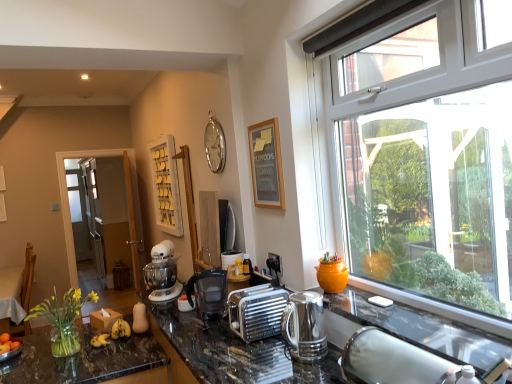
Question: Is white metallic mixer at center taller than white wooden shelf at upper center?

Choices:
 (A) yes
 (B) no

Answer: (B)

Question: Is white metallic mixer at center facing towards white wooden shelf at upper center?

Choices:
 (A) yes
 (B) no

Answer: (B)

Question: Is white metallic mixer at center not close to white wooden shelf at upper center?

Choices:
 (A) yes
 (B) no

Answer: (B)

Question: From the image's perspective, would you say white metallic mixer at center is shown under white wooden shelf at upper center?

Choices:
 (A) yes
 (B) no

Answer: (A)

Question: Is white metallic mixer at center positioned before white wooden shelf at upper center?

Choices:
 (A) no
 (B) yes

Answer: (B)

Question: From a real-world perspective, relative to silver metallic toaster at center, the 2th appliance from the top, is orange matte bowl at lower left vertically above or below?

Choices:
 (A) above
 (B) below

Answer: (B)

Question: Is orange matte bowl at lower left in front of or behind silver metallic toaster at center, the first appliance positioned from the front, in the image?

Choices:
 (A) front
 (B) behind

Answer: (B)

Question: Is orange matte bowl at lower left spatially inside silver metallic toaster at center, which is the first appliance in bottom-to-top order, or outside of it?

Choices:
 (A) inside
 (B) outside

Answer: (B)

Question: From the image's perspective, is orange matte bowl at lower left positioned above or below silver metallic toaster at center, which is the first appliance in bottom-to-top order?

Choices:
 (A) below
 (B) above

Answer: (A)

Question: From their relative heights in the image, would you say translucent glass countertop at lower left is taller or shorter than yellow matte bananas at center?

Choices:
 (A) short
 (B) tall

Answer: (B)

Question: From the image's perspective, relative to yellow matte bananas at center, is translucent glass countertop at lower left above or below?

Choices:
 (A) above
 (B) below

Answer: (B)

Question: Considering their positions, is translucent glass countertop at lower left located in front of or behind yellow matte bananas at center?

Choices:
 (A) behind
 (B) front

Answer: (B)

Question: Looking at their shapes, would you say translucent glass countertop at lower left is wider or thinner than yellow matte bananas at center?

Choices:
 (A) wide
 (B) thin

Answer: (A)

Question: Considering their positions, is silver metallic toaster at center, the second appliance positioned from the back, located in front of or behind wooden chair at left?

Choices:
 (A) behind
 (B) front

Answer: (B)

Question: Looking at their shapes, would you say silver metallic toaster at center, which is the first appliance in bottom-to-top order, is wider or thinner than wooden chair at left?

Choices:
 (A) wide
 (B) thin

Answer: (B)